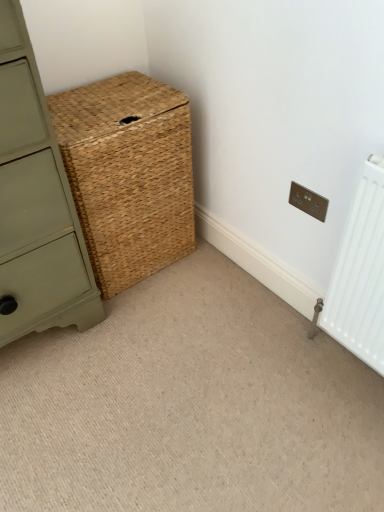
Question: Can you confirm if natural woven basket at center is bigger than matte green chest of drawers at center-left?

Choices:
 (A) yes
 (B) no

Answer: (B)

Question: From the image's perspective, would you say natural woven basket at center is positioned over matte green chest of drawers at center-left?

Choices:
 (A) no
 (B) yes

Answer: (B)

Question: Would you say natural woven basket at center contains matte green chest of drawers at center-left?

Choices:
 (A) no
 (B) yes

Answer: (A)

Question: Is natural woven basket at center facing towards matte green chest of drawers at center-left?

Choices:
 (A) no
 (B) yes

Answer: (A)

Question: Is natural woven basket at center to the right of matte green chest of drawers at center-left from the viewer's perspective?

Choices:
 (A) no
 (B) yes

Answer: (B)

Question: Considering the positions of natural woven basket at center and matte silver electric outlet at upper right in the image, is natural woven basket at center taller or shorter than matte silver electric outlet at upper right?

Choices:
 (A) tall
 (B) short

Answer: (A)

Question: Is natural woven basket at center wider or thinner than matte silver electric outlet at upper right?

Choices:
 (A) thin
 (B) wide

Answer: (B)

Question: Is natural woven basket at center to the left or to the right of matte silver electric outlet at upper right in the image?

Choices:
 (A) left
 (B) right

Answer: (A)

Question: Considering their positions, is natural woven basket at center located in front of or behind matte silver electric outlet at upper right?

Choices:
 (A) behind
 (B) front

Answer: (B)

Question: From a real-world perspective, is natural woven basket at center above or below natural woven basket at center?

Choices:
 (A) above
 (B) below

Answer: (A)

Question: Looking at the image, does natural woven basket at center seem bigger or smaller compared to natural woven basket at center?

Choices:
 (A) small
 (B) big

Answer: (B)

Question: In the image, is natural woven basket at center on the left side or the right side of natural woven basket at center?

Choices:
 (A) left
 (B) right

Answer: (A)

Question: Considering their positions, is natural woven basket at center located in front of or behind natural woven basket at center?

Choices:
 (A) front
 (B) behind

Answer: (B)

Question: Considering the positions of matte green chest of drawers at center-left and matte silver electric outlet at upper right in the image, is matte green chest of drawers at center-left bigger or smaller than matte silver electric outlet at upper right?

Choices:
 (A) small
 (B) big

Answer: (B)

Question: From the image's perspective, is matte green chest of drawers at center-left positioned above or below matte silver electric outlet at upper right?

Choices:
 (A) above
 (B) below

Answer: (B)